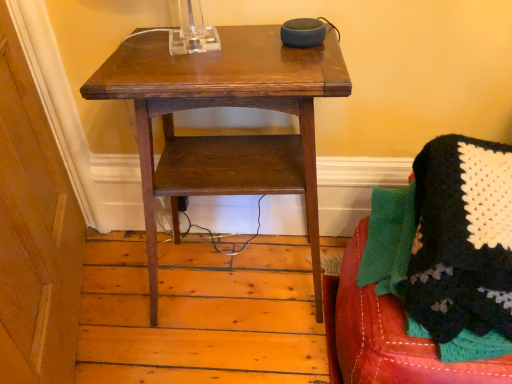
Question: From the image's perspective, is wooden table at center located beneath knitted fabric blanket at lower right?

Choices:
 (A) no
 (B) yes

Answer: (A)

Question: From the image's perspective, is wooden table at center located above knitted fabric blanket at lower right?

Choices:
 (A) no
 (B) yes

Answer: (B)

Question: Can you confirm if wooden table at center is thinner than knitted fabric blanket at lower right?

Choices:
 (A) yes
 (B) no

Answer: (A)

Question: Considering the relative sizes of wooden table at center and knitted fabric blanket at lower right in the image provided, is wooden table at center shorter than knitted fabric blanket at lower right?

Choices:
 (A) yes
 (B) no

Answer: (B)

Question: Does wooden table at center touch knitted fabric blanket at lower right?

Choices:
 (A) no
 (B) yes

Answer: (A)

Question: Is wooden table at center smaller than knitted fabric blanket at lower right?

Choices:
 (A) no
 (B) yes

Answer: (A)

Question: From the image's perspective, is knitted fabric blanket at lower right over wooden table at center?

Choices:
 (A) yes
 (B) no

Answer: (B)

Question: Considering the relative sizes of knitted fabric blanket at lower right and wooden table at center in the image provided, is knitted fabric blanket at lower right bigger than wooden table at center?

Choices:
 (A) yes
 (B) no

Answer: (B)

Question: Can you confirm if knitted fabric blanket at lower right is positioned to the left of wooden table at center?

Choices:
 (A) no
 (B) yes

Answer: (A)

Question: Does knitted fabric blanket at lower right have a lesser height compared to wooden table at center?

Choices:
 (A) yes
 (B) no

Answer: (A)

Question: From a real-world perspective, is knitted fabric blanket at lower right positioned over wooden table at center based on gravity?

Choices:
 (A) no
 (B) yes

Answer: (B)

Question: Does knitted fabric blanket at lower right have a greater height compared to wooden table at center?

Choices:
 (A) yes
 (B) no

Answer: (B)

Question: Looking at the image, does knitted fabric blanket at lower right seem bigger or smaller compared to wooden table at center?

Choices:
 (A) small
 (B) big

Answer: (A)